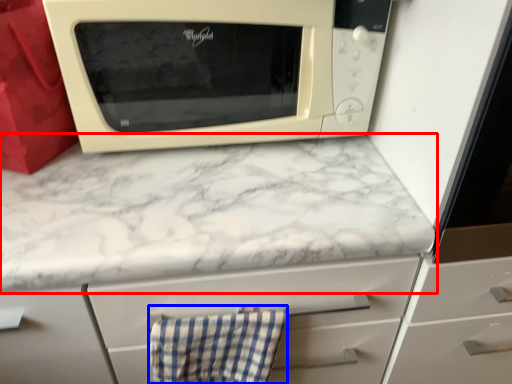
Question: Among these objects, which one is nearest to the camera, countertop (highlighted by a red box) or hand towel (highlighted by a blue box)?

Choices:
 (A) countertop
 (B) hand towel

Answer: (A)